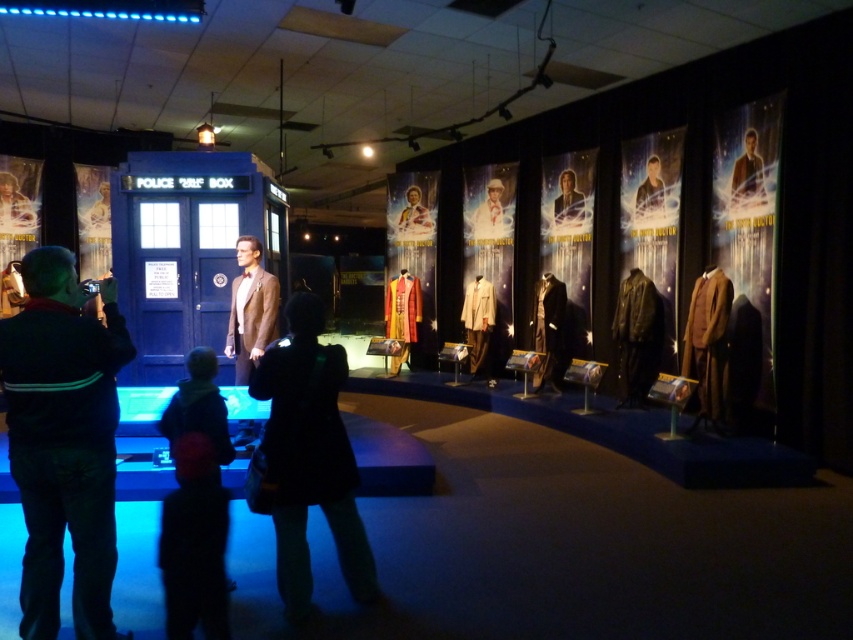
You are a visitor at the Doctor Who exhibit and notice two coats displayed nearby. The first is a brown leather jacket at upper center, and the second is a silky gold coat at center. From your vantage point, which coat appears closer to you?

The brown leather jacket at upper center appears closer because it is positioned below the silky gold coat at center, indicating it is lower in the visual hierarchy and thus nearer to the viewer.

You are a visitor at the Doctor Who exhibit and notice two coats displayed nearby. The first is a brown leather jacket at upper center, and the second is a silky gold coat at center. Which coat appears to be taller when viewed from your position?

The silky gold coat at center is taller than the brown leather jacket at upper center.